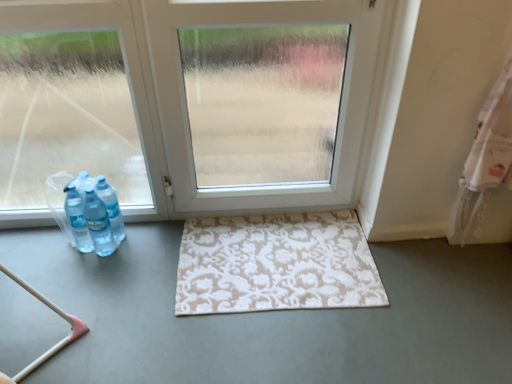
Measure the distance between beige patterned rug at center and camera.

A distance of 1.54 meters exists between beige patterned rug at center and camera.

Locate an element on the screen. The height and width of the screenshot is (384, 512). white matte rug at center is located at coordinates (272, 318).

Where is `translucent plastic bottles at left`? translucent plastic bottles at left is located at coordinates click(x=99, y=212).

Identify the location of beige patterned rug at center. (275, 264).

Consider the image. Which of these two, beige patterned rug at center or translucent plastic bottles at left, stands taller?

translucent plastic bottles at left.

Which of these two, beige patterned rug at center or translucent plastic bottles at left, is bigger?

With larger size is translucent plastic bottles at left.

Considering the points (357, 281) and (71, 188), which point is in front, point (357, 281) or point (71, 188)?

The point (357, 281) is closer.

Where is `bottle on the left of white matte rug at center`? bottle on the left of white matte rug at center is located at coordinates (99, 212).

Are translucent plastic bottles at left and white matte rug at center located far from each other?

They are positioned close to each other.

From the image's perspective, between translucent plastic bottles at left and white matte rug at center, which one is located above?

translucent plastic bottles at left is shown above in the image.

Which of these two, translucent plastic bottles at left or white matte rug at center, stands shorter?

Standing shorter between the two is white matte rug at center.

Considering the sizes of objects translucent plastic bottles at left and white matte door at center in the image provided, who is smaller, translucent plastic bottles at left or white matte door at center?

translucent plastic bottles at left is smaller.

Between translucent plastic bottles at left and white matte door at center, which one has larger width?

translucent plastic bottles at left is wider.

Which point is more distant from viewer, (102, 204) or (234, 9)?

Point (102, 204)

From a real-world perspective, is white matte rug at center physically located above or below translucent plastic bottles at left?

From a real-world perspective, white matte rug at center is physically below translucent plastic bottles at left.

Does white matte rug at center have a lesser width compared to translucent plastic bottles at left?

No, white matte rug at center is not thinner than translucent plastic bottles at left.

Based on the photo, from their relative heights in the image, would you say white matte rug at center is taller or shorter than translucent plastic bottles at left?

Considering their sizes, white matte rug at center has less height than translucent plastic bottles at left.

Based on the photo, in the image, is white matte rug at center on the left side or the right side of translucent plastic bottles at left?

white matte rug at center is positioned on translucent plastic bottles at left's right side.

Is the depth of white matte door at center greater than that of white matte rug at center?

A: Yes, white matte door at center is behind white matte rug at center.

You are a GUI agent. You are given a task and a screenshot of the screen. Output one action in this format:
    pyautogui.click(x=<x>, y=<y>)
    Task: Click on the door located behind the white matte rug at center
    This screenshot has width=512, height=384.
    Given the screenshot: What is the action you would take?
    pyautogui.click(x=336, y=108)

Is white matte door at center thinner than white matte rug at center?

Yes.

Does white matte rug at center appear on the left side of beige patterned rug at center?

Correct, you'll find white matte rug at center to the left of beige patterned rug at center.

From a real-world perspective, is white matte rug at center physically below beige patterned rug at center?

Indeed, from a real-world perspective, white matte rug at center is positioned beneath beige patterned rug at center.

Considering the relative sizes of white matte rug at center and beige patterned rug at center in the image provided, is white matte rug at center smaller than beige patterned rug at center?

Incorrect, white matte rug at center is not smaller in size than beige patterned rug at center.

Who is shorter, white matte rug at center or beige patterned rug at center?

With less height is beige patterned rug at center.

Is translucent plastic bottles at left at the back of white matte door at center?

That's not correct — white matte door at center is not looking away from translucent plastic bottles at left.

Is translucent plastic bottles at left inside white matte door at center?

No.

Locate an element on the screen. bottle lying on the left of beige patterned rug at center is located at coordinates (99, 212).

Locate an element on the screen. The height and width of the screenshot is (384, 512). concrete beneath the translucent plastic bottles at left (from a real-world perspective) is located at coordinates (272, 318).

Which object lies further to the anchor point beige patterned rug at center, white matte rug at center or translucent plastic bottles at left?

translucent plastic bottles at left lies further to beige patterned rug at center than the other object.

Which object lies further to the anchor point white matte door at center, white matte rug at center or beige patterned rug at center?

The object further to white matte door at center is white matte rug at center.

Estimate the real-world distances between objects in this image. Which object is closer to white matte rug at center, white matte door at center or translucent plastic bottles at left?

The object closer to white matte rug at center is translucent plastic bottles at left.

From the image, which object appears to be farther from white matte rug at center, white matte door at center or beige patterned rug at center?

Answer: The object further to white matte rug at center is white matte door at center.

When comparing their distances from beige patterned rug at center, does white matte door at center or white matte rug at center seem further?

white matte door at center is further to beige patterned rug at center.

When comparing their distances from white matte rug at center, does translucent plastic bottles at left or beige patterned rug at center seem closer?

beige patterned rug at center lies closer to white matte rug at center than the other object.

Based on their spatial positions, is translucent plastic bottles at left or white matte door at center closer to white matte rug at center?

translucent plastic bottles at left is closer to white matte rug at center.

Based on their spatial positions, is beige patterned rug at center or translucent plastic bottles at left closer to white matte door at center?

Among the two, beige patterned rug at center is located nearer to white matte door at center.

The width and height of the screenshot is (512, 384). Find the location of `concrete between translucent plastic bottles at left and beige patterned rug at center in the horizontal direction`. concrete between translucent plastic bottles at left and beige patterned rug at center in the horizontal direction is located at coordinates (272, 318).

At what (x,y) coordinates should I click in order to perform the action: click on door between translucent plastic bottles at left and beige patterned rug at center in the horizontal direction. Please return your answer as a coordinate pair (x, y). Looking at the image, I should click on (336, 108).

At what (x,y) coordinates should I click in order to perform the action: click on concrete located between translucent plastic bottles at left and white matte door at center in the left-right direction. Please return your answer as a coordinate pair (x, y). Looking at the image, I should click on (272, 318).

At what (x,y) coordinates should I click in order to perform the action: click on bath mat between white matte door at center and white matte rug at center in the up-down direction. Please return your answer as a coordinate pair (x, y). Looking at the image, I should click on (275, 264).